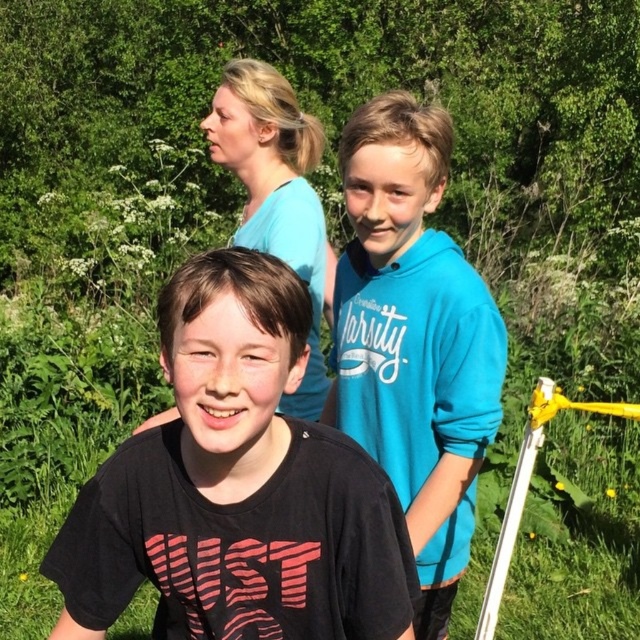
Question: Which of the following is the farthest from the observer?

Choices:
 (A) tap(225, 168)
 (B) tap(461, 561)
 (C) tap(300, 618)

Answer: (A)

Question: Is black matte shirt at center further to camera compared to blue fleece hoodie at center?

Choices:
 (A) no
 (B) yes

Answer: (A)

Question: Which object is positioned closest to the blue cotton shirt at upper center?

Choices:
 (A) blue fleece hoodie at center
 (B) black matte shirt at center

Answer: (A)

Question: From the image, what is the correct spatial relationship of black matte shirt at center in relation to blue cotton shirt at upper center?

Choices:
 (A) right
 (B) left

Answer: (B)

Question: Which point is farther to the camera?

Choices:
 (A) pos(436,304)
 (B) pos(378,614)

Answer: (A)

Question: Is black matte shirt at center above blue fleece hoodie at center?

Choices:
 (A) no
 (B) yes

Answer: (A)